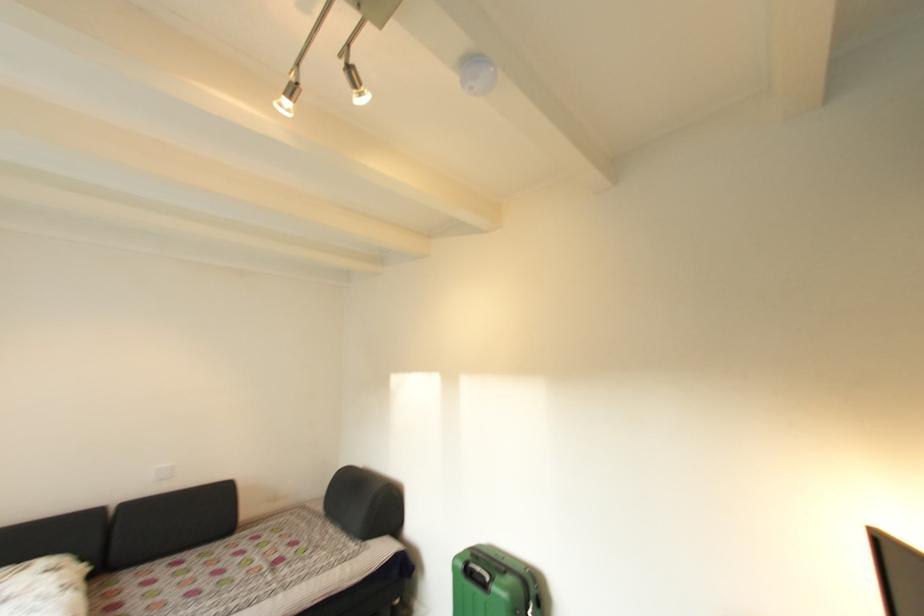
Identify the location of white wall outlet. The width and height of the screenshot is (924, 616). (163, 472).